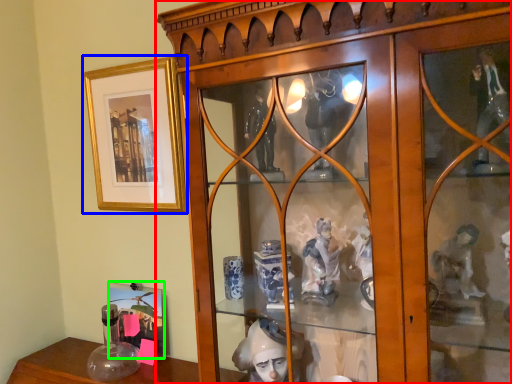
Question: Based on their relative distances, which object is nearer to furniture (highlighted by a red box)? Choose from picture frame (highlighted by a blue box) and picture frame (highlighted by a green box).

Choices:
 (A) picture frame
 (B) picture frame

Answer: (A)